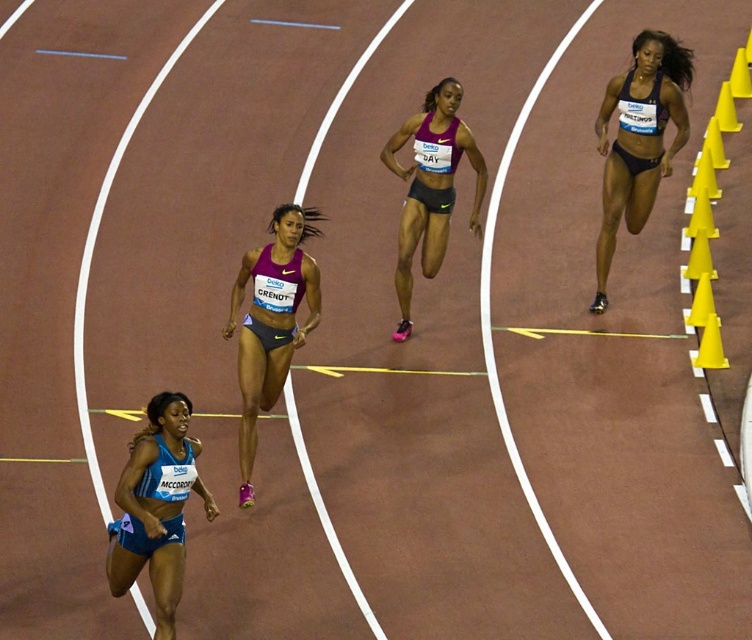
Question: Does matte purple tank top at center have a smaller size compared to purple matte shorts at center?

Choices:
 (A) yes
 (B) no

Answer: (A)

Question: Does matte purple tank top at center appear on the left side of purple matte shorts at center?

Choices:
 (A) yes
 (B) no

Answer: (A)

Question: Is blue fabric shorts at lower left closer to camera compared to purple matte shorts at center?

Choices:
 (A) yes
 (B) no

Answer: (A)

Question: Which of the following is the closest to the observer?

Choices:
 (A) dark blue fabric shorts at right
 (B) matte purple tank top at center
 (C) purple matte shorts at center

Answer: (B)

Question: Based on their relative distances, which object is farther from the blue fabric shorts at lower left?

Choices:
 (A) matte purple tank top at center
 (B) purple matte shorts at center

Answer: (B)

Question: Estimate the real-world distances between objects in this image. Which object is farther from the matte purple tank top at center?

Choices:
 (A) blue fabric shorts at lower left
 (B) dark blue fabric shorts at right

Answer: (B)